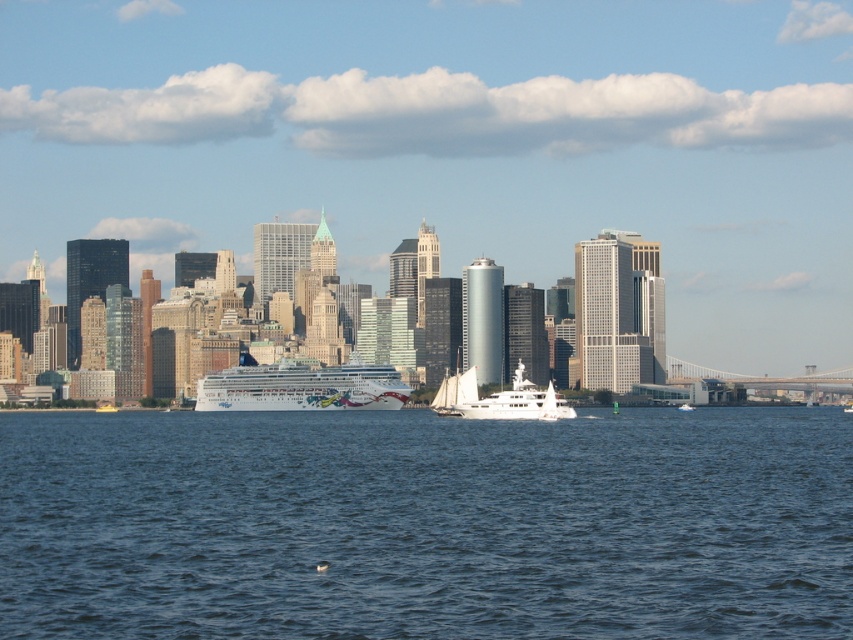
Between blue water at center and white glossy sailboat at center, which one appears on the left side from the viewer's perspective?

Positioned to the left is blue water at center.

Does blue water at center have a larger size compared to white glossy sailboat at center?

Correct, blue water at center is larger in size than white glossy sailboat at center.

Between point (483, 584) and point (457, 381), which one is positioned behind?

The point (483, 584) is more distant.

Find the location of `blue water at center`. blue water at center is located at coordinates (426, 524).

Does white glossy cruise ship at center have a larger size compared to white glossy sailboat at center?

Yes.

Who is taller, white glossy cruise ship at center or white glossy sailboat at center?

Standing taller between the two is white glossy cruise ship at center.

Where is `white glossy cruise ship at center`? This screenshot has width=853, height=640. white glossy cruise ship at center is located at coordinates (302, 387).

Find the location of `white glossy cruise ship at center`. white glossy cruise ship at center is located at coordinates (302, 387).

Is point (755, 433) positioned behind point (300, 406)?

That is True.

Between blue water at center and white glossy cruise ship at center, which one appears on the left side from the viewer's perspective?

white glossy cruise ship at center

Identify the location of blue water at center. This screenshot has width=853, height=640. (426, 524).

Where is `blue water at center`? blue water at center is located at coordinates (426, 524).